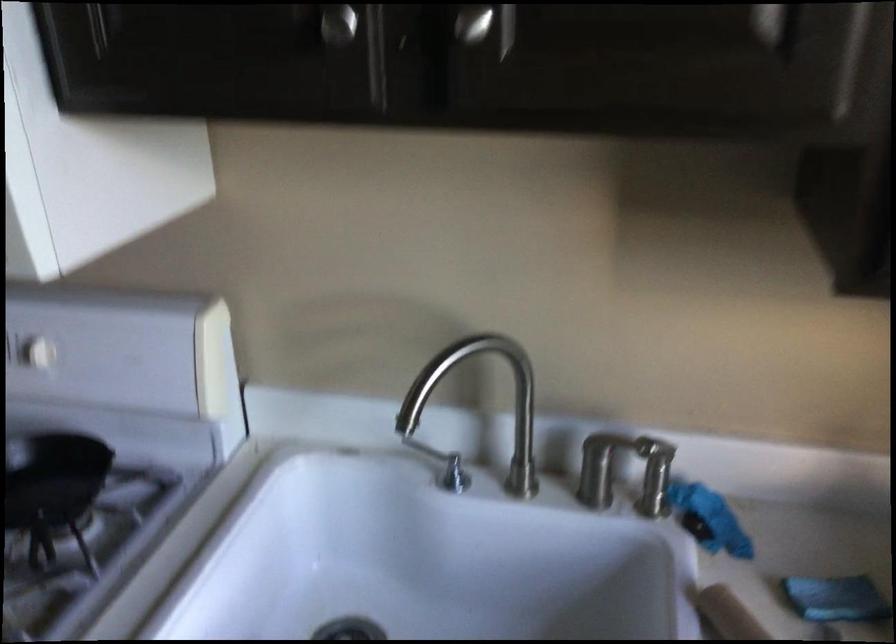
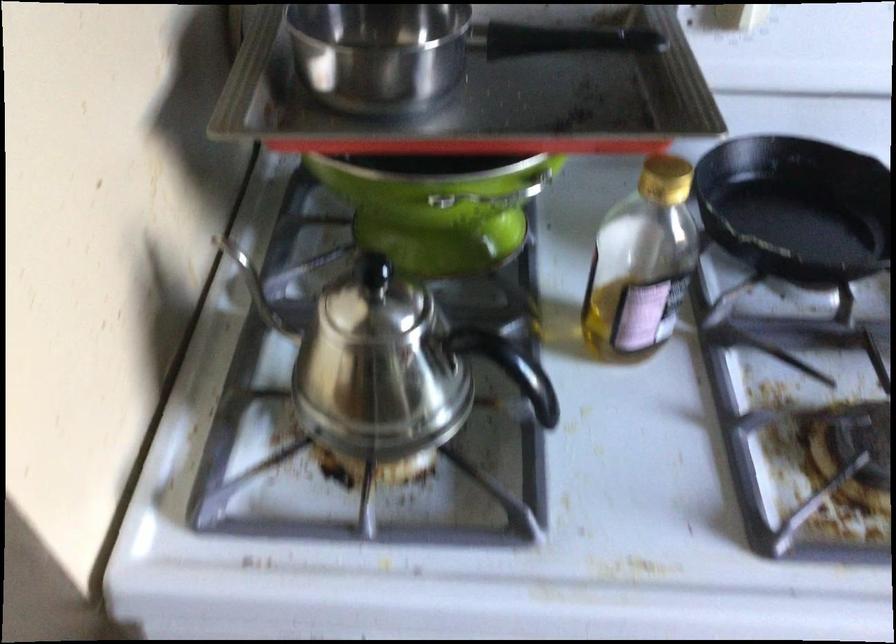
The images are taken continuously from a first-person perspective. In which direction are you moving?

The cameraman moved toward left, forward.